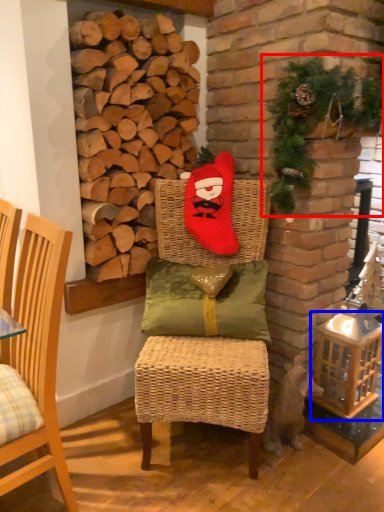
Question: Which object appears farthest to the camera in this image, christmas decoration (highlighted by a red box) or basket (highlighted by a blue box)?

Choices:
 (A) christmas decoration
 (B) basket

Answer: (B)